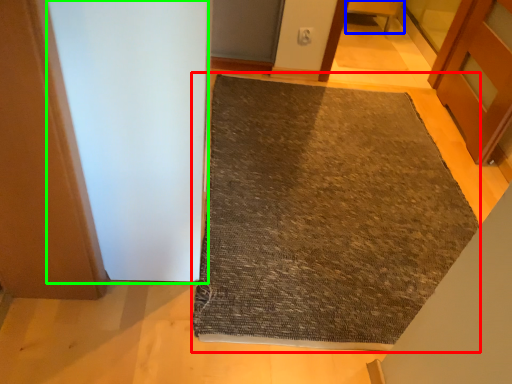
Question: Which object is the farthest from mat (highlighted by a red box)? Choose among these: furniture (highlighted by a blue box) or screen door (highlighted by a green box).

Choices:
 (A) furniture
 (B) screen door

Answer: (A)